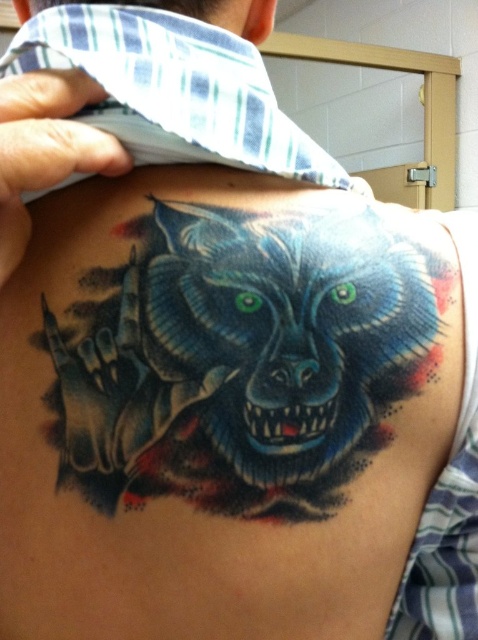
You are a tattoo artist reviewing a client who has a tattoo on their upper back. You need to determine if the colorful ink wolf at upper right will overshadow the matte blue neck at upper center in terms of visual prominence. Based on the description, which object is larger?

The colorful ink wolf at upper right is larger in size than the matte blue neck at upper center, so it will overshadow it in visual prominence.

You are a tattoo artist reviewing the design on a client. The client wants to add a small star tattoo near the existing wolf tattoo on their upper back. You need to place it at point (245, 353). Based on the scene description, where exactly on the wolf will this star be placed?

The point (245, 353) is on the colorful ink wolf at upper right, so the star will be placed on the wolf itself.

You are a photographer taking a closeup shot of the tattoo on the upper back. You notice the blue plaid tie at upper left and the matte blue neck at upper center in your frame. Which object should you focus on if you want to capture the larger one in detail?

The blue plaid tie at upper left is larger in size than the matte blue neck at upper center, so you should focus on the blue plaid tie at upper left to capture the larger one in detail.